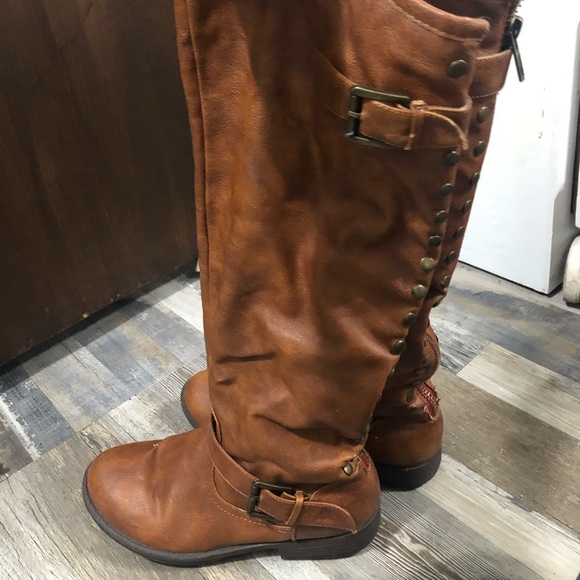
Where is `wood wall`? This screenshot has height=580, width=580. wood wall is located at coordinates (61, 122).